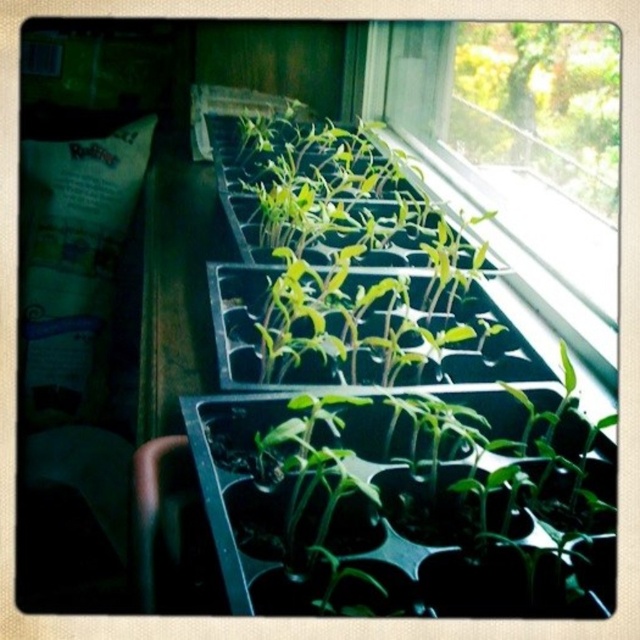
You are a gardener who wants to plant a new seedling in the black plastic trays on the windowsill. The trays are arranged in a row. You need to place the new seedling exactly at point [348,262]. However, you notice that there are already seedlings growing there. Can you plant your new seedling there without disturbing the existing ones?

At point [348,262] lies green matte seedlings at center, so you cannot plant the new seedling there without disturbing the existing ones.

You are a gardener checking the growth of plants. You have two groups of seedlings to observe. One is the green matte seedlings at center and the other is the transparent plastic tray of seedlings at upper right. Which group of seedlings is taller?

→ The transparent plastic tray of seedlings at upper right is taller than the green matte seedlings at center.